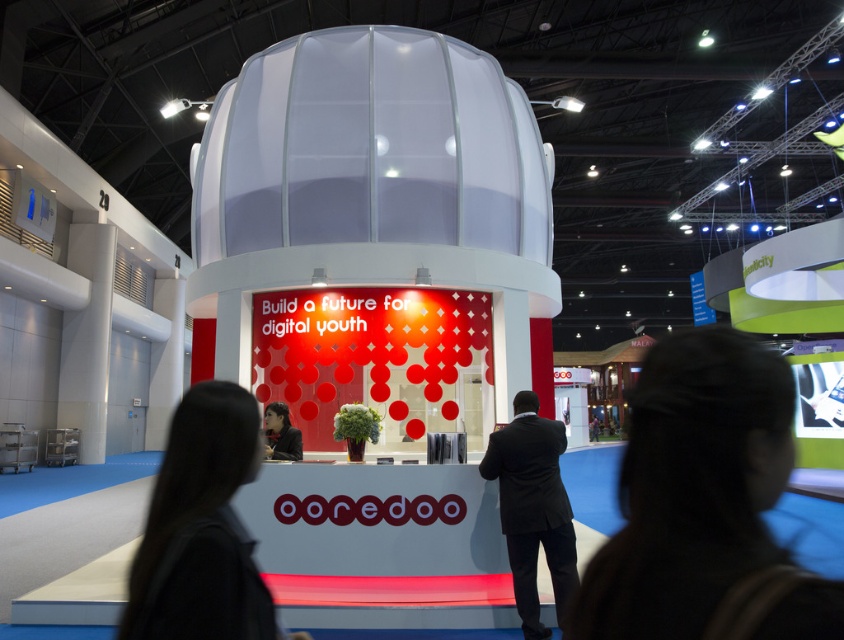
Question: Is matte black desk at center closer to the viewer compared to matte black jacket at center?

Choices:
 (A) no
 (B) yes

Answer: (B)

Question: Which of these objects is positioned farthest from the matte black laptop at center?

Choices:
 (A) matte black desk at center
 (B) matte black jacket at center

Answer: (B)

Question: Which of the following is the closest to the observer?

Choices:
 (A) (280, 433)
 (B) (235, 452)
 (C) (774, 612)

Answer: (C)

Question: Does black suit at center appear on the left side of matte black jacket at center?

Choices:
 (A) yes
 (B) no

Answer: (B)

Question: Among these points, which one is farthest from the camera?

Choices:
 (A) (545, 529)
 (B) (235, 397)
 (C) (582, 605)
 (D) (285, 458)

Answer: (D)

Question: Is black suit at center in front of matte black jacket at center?

Choices:
 (A) no
 (B) yes

Answer: (B)